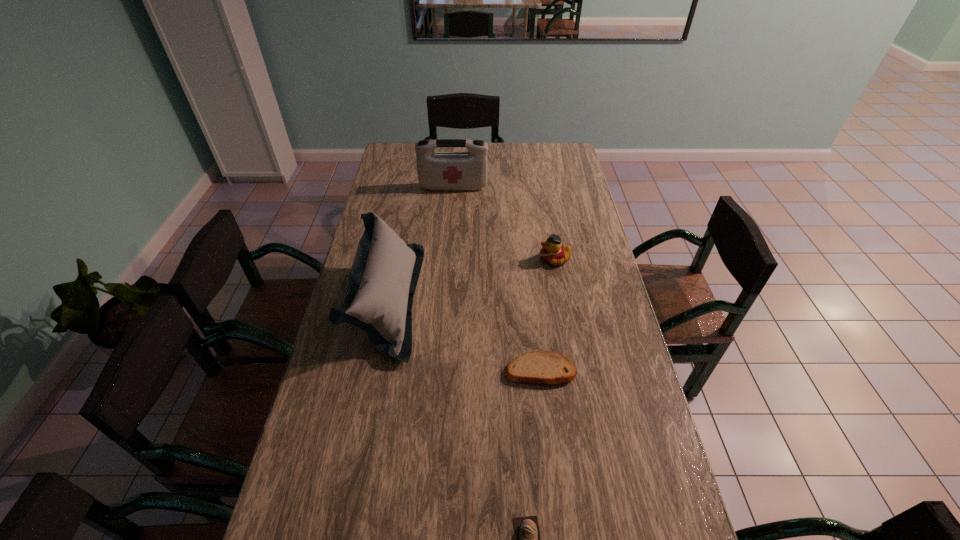
Select which object appears as the second closest to the nearer pita bread. Please provide its 2D coordinates. Your answer should be formatted as a tuple, i.e. [(x, y)], where the tuple contains the x and y coordinates of a point satisfying the conditions above.

[(382, 281)]

Identify which object is located as the second nearest to the farthest object. Please provide its 2D coordinates. Your answer should be formatted as a tuple, i.e. [(x, y)], where the tuple contains the x and y coordinates of a point satisfying the conditions above.

[(553, 252)]

This screenshot has height=540, width=960. In order to click on pita bread that is the second closest to the duck in this screenshot , I will do `click(528, 539)`.

You are a GUI agent. You are given a task and a screenshot of the screen. Output one action in this format:
    pyautogui.click(x=<x>, y=<y>)
    Task: Click on the pita bread that is the second closest to the first-aid kit
    The width and height of the screenshot is (960, 540).
    Given the screenshot: What is the action you would take?
    pyautogui.click(x=528, y=539)

The height and width of the screenshot is (540, 960). I want to click on blank space that satisfies the following two spatial constraints: 1. on the front side of the first-aid kit; 2. on the left side of the farther pita bread, so click(x=440, y=370).

Find the location of a particular element. The width and height of the screenshot is (960, 540). free space that satisfies the following two spatial constraints: 1. on the front side of the farthest object; 2. on the surface of the cushion is located at coordinates point(444,300).

Locate an element on the screen. The image size is (960, 540). free space that satisfies the following two spatial constraints: 1. on the back side of the farther pita bread; 2. on the surface of the cushion is located at coordinates (533, 300).